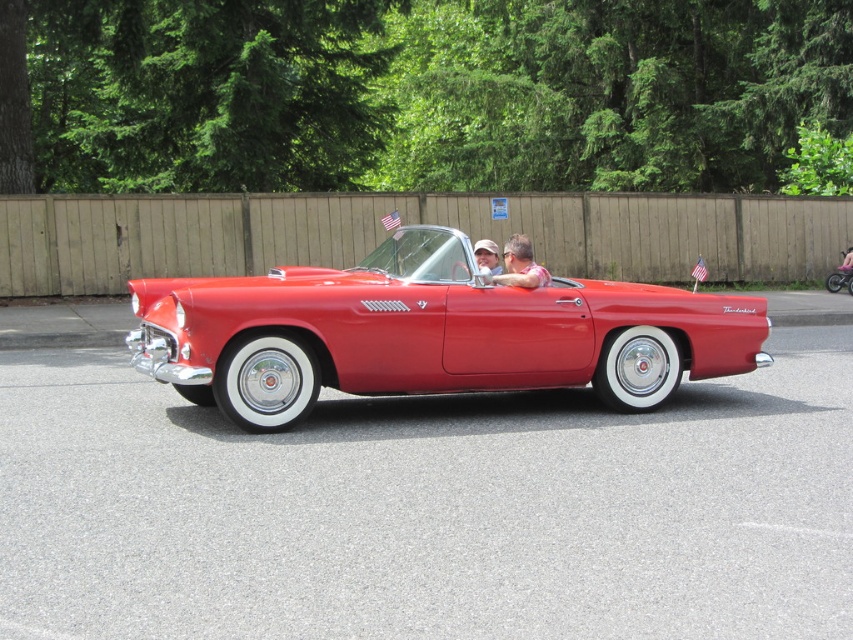
You are a passenger in the shiny red convertible at center and want to hand the matte black sunglasses at center to the driver. Which direction should you move your hand to pass them?

The shiny red convertible at center is positioned on the left side of matte black sunglasses at center, so you should move your hand to the right to pass the matte black sunglasses at center to the driver.

You are a passenger in the shiny red convertible at center and want to hand the matte black sunglasses at center to the driver. Which direction should you pass them to ensure they reach the driver?

The shiny red convertible at center is closer to the viewer than the matte black sunglasses at center, so you should pass the matte black sunglasses at center towards the front of the car to reach the driver.